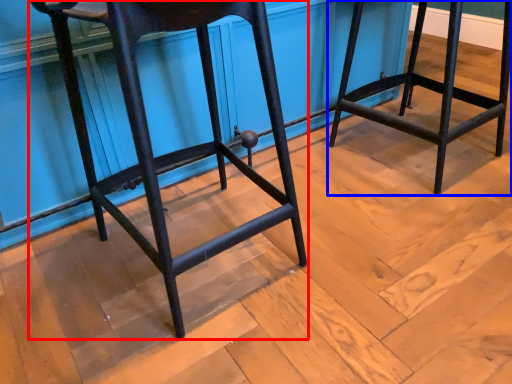
Question: Which point is further to the camera, furniture (highlighted by a red box) or furniture (highlighted by a blue box)?

Choices:
 (A) furniture
 (B) furniture

Answer: (B)